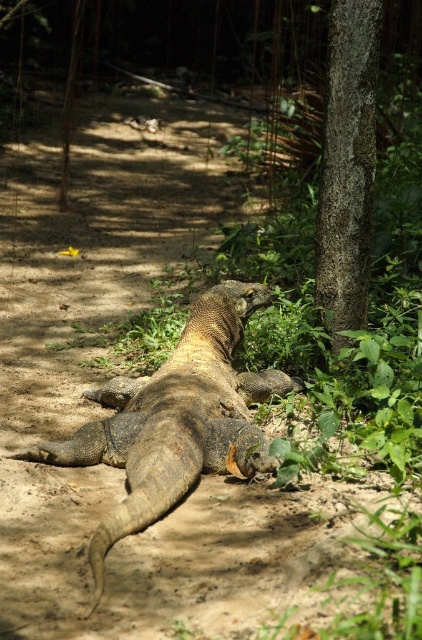
Question: Can you confirm if leathery brown lizard at center is positioned below smooth bark tree trunk at right?

Choices:
 (A) yes
 (B) no

Answer: (A)

Question: Does leathery brown lizard at center appear under smooth bark tree trunk at right?

Choices:
 (A) yes
 (B) no

Answer: (A)

Question: Which object is farther from the camera taking this photo?

Choices:
 (A) smooth bark tree trunk at right
 (B) leathery brown lizard at center

Answer: (A)

Question: Where is leathery brown lizard at center located in relation to smooth bark tree trunk at right in the image?

Choices:
 (A) above
 (B) below

Answer: (B)